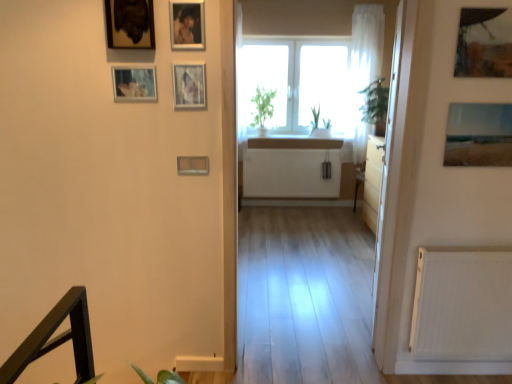
Measure the distance between point (147, 45) and camera.

Point (147, 45) and camera are 1.94 meters apart.

Identify the location of metallic silver picture frame at upper left, the seventh picture frame positioned from the right. (134, 83).

Measure the distance between point [189,31] and camera.

A distance of 1.93 meters exists between point [189,31] and camera.

This screenshot has height=384, width=512. What do you see at coordinates (187, 25) in the screenshot?
I see `metallic photo frame at upper center, arranged as the 4th picture frame when viewed from the left` at bounding box center [187, 25].

Measure the distance between matte plastic picture frame at center, which ranks as the fifth picture frame in right-to-left order, and camera.

The depth of matte plastic picture frame at center, which ranks as the fifth picture frame in right-to-left order, is 6.82 feet.

This screenshot has height=384, width=512. What do you see at coordinates (189, 85) in the screenshot?
I see `metallic silver picture frame at upper center, which ranks as the 3th picture frame in right-to-left order` at bounding box center [189, 85].

Identify the location of matte glass landscape photo at upper right, placed as the seventh picture frame when sorted from left to right. This screenshot has height=384, width=512. (479, 135).

Is transparent glass door at right located within metallic photo frame at upper center, arranged as the 4th picture frame when viewed from the left?

No.

Is point (179, 6) closer or farther from the camera than point (372, 339)?

Point (179, 6) is closer to the camera than point (372, 339).

Starting from the transparent glass door at right, which picture frame is the 5th one in front? Please provide its 2D coordinates.

[(187, 25)]

Based on the photo, is metallic photo frame at upper center, arranged as the 4th picture frame when viewed from the left, in contact with transparent glass door at right?

metallic photo frame at upper center, arranged as the 4th picture frame when viewed from the left, and transparent glass door at right are not in contact.

Considering the relative sizes of matte plastic picture frame at center, the third picture frame positioned from the left, and metallic reflective photo frame at upper right, which appears as the 6th picture frame when viewed from the left, in the image provided, is matte plastic picture frame at center, the third picture frame positioned from the left, thinner than metallic reflective photo frame at upper right, which appears as the 6th picture frame when viewed from the left,?

No, matte plastic picture frame at center, the third picture frame positioned from the left, is not thinner than metallic reflective photo frame at upper right, which appears as the 6th picture frame when viewed from the left.

Which object is further away from the camera, matte plastic picture frame at center, the third picture frame positioned from the left, or metallic reflective photo frame at upper right, which is counted as the 2th picture frame, starting from the right?

matte plastic picture frame at center, the third picture frame positioned from the left.

From the image's perspective, is matte plastic picture frame at center, the third picture frame positioned from the left, positioned above or below metallic reflective photo frame at upper right, which appears as the 6th picture frame when viewed from the left?

From the image's perspective, matte plastic picture frame at center, the third picture frame positioned from the left, appears below metallic reflective photo frame at upper right, which appears as the 6th picture frame when viewed from the left.

How different are the orientations of transparent glass door at right and matte glass landscape photo at upper right, the first picture frame viewed from the right, in degrees?

There is a 105-degree angle between the facing directions of transparent glass door at right and matte glass landscape photo at upper right, the first picture frame viewed from the right.

Is transparent glass door at right taller than matte glass landscape photo at upper right, placed as the seventh picture frame when sorted from left to right?

Yes.

Where is `glass door located behind the matte glass landscape photo at upper right, the first picture frame viewed from the right`? The image size is (512, 384). glass door located behind the matte glass landscape photo at upper right, the first picture frame viewed from the right is located at coordinates (389, 191).

From a real-world perspective, which object rests below the other?

From a 3D spatial view, transparent glass door at right is below.

Between metallic silver picture frame at upper left, the seventh picture frame positioned from the right, and matte plastic picture frame at center, which ranks as the fifth picture frame in right-to-left order, which one has less height?

With less height is matte plastic picture frame at center, which ranks as the fifth picture frame in right-to-left order.

From a real-world perspective, relative to matte plastic picture frame at center, the third picture frame positioned from the left, is metallic silver picture frame at upper left, the seventh picture frame positioned from the right, vertically above or below?

In terms of real-world spatial position, metallic silver picture frame at upper left, the seventh picture frame positioned from the right, is above matte plastic picture frame at center, the third picture frame positioned from the left.

Considering the sizes of objects metallic silver picture frame at upper left, the seventh picture frame positioned from the right, and matte plastic picture frame at center, which ranks as the fifth picture frame in right-to-left order, in the image provided, who is thinner, metallic silver picture frame at upper left, the seventh picture frame positioned from the right, or matte plastic picture frame at center, which ranks as the fifth picture frame in right-to-left order,?

Thinner between the two is metallic silver picture frame at upper left, the seventh picture frame positioned from the right.

Is matte plastic picture frame at center, which ranks as the fifth picture frame in right-to-left order, located within metallic silver picture frame at upper left, the first picture frame in the left-to-right sequence?

Actually, matte plastic picture frame at center, which ranks as the fifth picture frame in right-to-left order, is outside metallic silver picture frame at upper left, the first picture frame in the left-to-right sequence.

Based on the photo, how many degrees apart are the facing directions of metallic silver picture frame at upper left, the first picture frame in the left-to-right sequence, and metallic silver picture frame at upper center, which appears as the 5th picture frame when viewed from the left?

They differ by 0.00981 degrees in their facing directions.

Can you see metallic silver picture frame at upper left, the first picture frame in the left-to-right sequence, touching metallic silver picture frame at upper center, which appears as the 5th picture frame when viewed from the left?

metallic silver picture frame at upper left, the first picture frame in the left-to-right sequence, and metallic silver picture frame at upper center, which appears as the 5th picture frame when viewed from the left, are clearly separated.

Considering the sizes of objects metallic silver picture frame at upper left, the first picture frame in the left-to-right sequence, and metallic silver picture frame at upper center, which ranks as the 3th picture frame in right-to-left order, in the image provided, who is smaller, metallic silver picture frame at upper left, the first picture frame in the left-to-right sequence, or metallic silver picture frame at upper center, which ranks as the 3th picture frame in right-to-left order,?

With smaller size is metallic silver picture frame at upper left, the first picture frame in the left-to-right sequence.

In the scene shown: Considering the sizes of metallic silver picture frame at upper left, the seventh picture frame positioned from the right, and metallic silver picture frame at upper center, which appears as the 5th picture frame when viewed from the left, in the image, is metallic silver picture frame at upper left, the seventh picture frame positioned from the right, taller or shorter than metallic silver picture frame at upper center, which appears as the 5th picture frame when viewed from the left,?

In the image, metallic silver picture frame at upper left, the seventh picture frame positioned from the right, appears to be shorter than metallic silver picture frame at upper center, which appears as the 5th picture frame when viewed from the left.

Looking at this image, are metallic silver picture frame at upper left, the first picture frame in the left-to-right sequence, and metallic photo frame at upper center, arranged as the 4th picture frame when viewed from the left, located far from each other?

metallic silver picture frame at upper left, the first picture frame in the left-to-right sequence, is near metallic photo frame at upper center, arranged as the 4th picture frame when viewed from the left, not far away.

Based on the photo, from a real-world perspective, is metallic silver picture frame at upper left, the seventh picture frame positioned from the right, physically located above or below metallic photo frame at upper center, arranged as the 4th picture frame when viewed from the left?

Clearly, from a real-world perspective, metallic silver picture frame at upper left, the seventh picture frame positioned from the right, is below metallic photo frame at upper center, arranged as the 4th picture frame when viewed from the left.

Is the position of metallic silver picture frame at upper left, the first picture frame in the left-to-right sequence, less distant than that of metallic photo frame at upper center, arranged as the 4th picture frame when viewed from the left?

No, metallic silver picture frame at upper left, the first picture frame in the left-to-right sequence, is behind metallic photo frame at upper center, arranged as the 4th picture frame when viewed from the left.

Is metallic silver picture frame at upper left, the first picture frame in the left-to-right sequence, bigger than metallic photo frame at upper center, arranged as the 4th picture frame when viewed from the left?

No, metallic silver picture frame at upper left, the first picture frame in the left-to-right sequence, is not bigger than metallic photo frame at upper center, arranged as the 4th picture frame when viewed from the left.

Is metallic silver picture frame at upper center, which ranks as the 3th picture frame in right-to-left order, not within metallic photo frame at upper center, placed as the 4th picture frame when sorted from right to left?

Yes, metallic silver picture frame at upper center, which ranks as the 3th picture frame in right-to-left order, is located beyond the bounds of metallic photo frame at upper center, placed as the 4th picture frame when sorted from right to left.

From a real-world perspective, which picture frame is the 3rd one underneath the metallic photo frame at upper center, arranged as the 4th picture frame when viewed from the left? Please provide its 2D coordinates.

[(189, 85)]

From the image's perspective, is metallic silver picture frame at upper center, which appears as the 5th picture frame when viewed from the left, located above or below metallic photo frame at upper center, arranged as the 4th picture frame when viewed from the left?

Based on their image positions, metallic silver picture frame at upper center, which appears as the 5th picture frame when viewed from the left, is located beneath metallic photo frame at upper center, arranged as the 4th picture frame when viewed from the left.

This screenshot has height=384, width=512. I want to click on glass door behind the metallic photo frame at upper center, placed as the 4th picture frame when sorted from right to left, so click(x=389, y=191).

Identify the location of the 4th picture frame directly beneath the metallic reflective photo frame at upper right, which appears as the 6th picture frame when viewed from the left (from a real-world perspective). Image resolution: width=512 pixels, height=384 pixels. (192, 165).

When comparing their distances from metallic reflective photo frame at upper right, which is counted as the 2th picture frame, starting from the right, does matte plastic picture frame at center, the third picture frame positioned from the left, or white matte radiator at right seem further?

matte plastic picture frame at center, the third picture frame positioned from the left, is further to metallic reflective photo frame at upper right, which is counted as the 2th picture frame, starting from the right.

Looking at the image, which one is located closer to metallic reflective photo frame at upper right, which appears as the 6th picture frame when viewed from the left, transparent glass door at right or metallic silver picture frame at upper center, which appears as the 5th picture frame when viewed from the left?

Based on the image, transparent glass door at right appears to be nearer to metallic reflective photo frame at upper right, which appears as the 6th picture frame when viewed from the left.

From the image, which object appears to be farther from metallic photo frame at upper center, arranged as the 4th picture frame when viewed from the left, metallic silver picture frame at upper left, the seventh picture frame positioned from the right, or wooden framed painting at upper left, acting as the sixth picture frame starting from the right?

metallic silver picture frame at upper left, the seventh picture frame positioned from the right, is positioned further to the anchor metallic photo frame at upper center, arranged as the 4th picture frame when viewed from the left.

Looking at the image, which one is located closer to metallic reflective photo frame at upper right, which is counted as the 2th picture frame, starting from the right, metallic photo frame at upper center, placed as the 4th picture frame when sorted from right to left, or wooden framed painting at upper left, which appears as the 2th picture frame when viewed from the left?

Among the two, metallic photo frame at upper center, placed as the 4th picture frame when sorted from right to left, is located nearer to metallic reflective photo frame at upper right, which is counted as the 2th picture frame, starting from the right.

When comparing their distances from matte plastic picture frame at center, the third picture frame positioned from the left, does metallic reflective photo frame at upper right, which is counted as the 2th picture frame, starting from the right, or metallic photo frame at upper center, placed as the 4th picture frame when sorted from right to left, seem closer?

metallic photo frame at upper center, placed as the 4th picture frame when sorted from right to left, is positioned closer to the anchor matte plastic picture frame at center, the third picture frame positioned from the left.

Based on their spatial positions, is wooden framed painting at upper left, which appears as the 2th picture frame when viewed from the left, or transparent glass door at right further from white matte radiator at right?

wooden framed painting at upper left, which appears as the 2th picture frame when viewed from the left, is positioned further to the anchor white matte radiator at right.

Which object lies nearer to the anchor point matte glass landscape photo at upper right, the first picture frame viewed from the right, wooden framed painting at upper left, which appears as the 2th picture frame when viewed from the left, or matte plastic picture frame at center, which ranks as the fifth picture frame in right-to-left order?

matte plastic picture frame at center, which ranks as the fifth picture frame in right-to-left order, is closer to matte glass landscape photo at upper right, the first picture frame viewed from the right.

Which object lies nearer to the anchor point metallic photo frame at upper center, arranged as the 4th picture frame when viewed from the left, matte plastic picture frame at center, the third picture frame positioned from the left, or white matte radiator at right?

matte plastic picture frame at center, the third picture frame positioned from the left, is positioned closer to the anchor metallic photo frame at upper center, arranged as the 4th picture frame when viewed from the left.

You are a GUI agent. You are given a task and a screenshot of the screen. Output one action in this format:
    pyautogui.click(x=<x>, y=<y>)
    Task: Click on the glass door located between metallic silver picture frame at upper left, the first picture frame in the left-to-right sequence, and metallic reflective photo frame at upper right, which is counted as the 2th picture frame, starting from the right, in the left-right direction
    The height and width of the screenshot is (384, 512).
    Given the screenshot: What is the action you would take?
    pyautogui.click(x=389, y=191)

You are a GUI agent. You are given a task and a screenshot of the screen. Output one action in this format:
    pyautogui.click(x=<x>, y=<y>)
    Task: Click on the glass door situated between metallic silver picture frame at upper left, the first picture frame in the left-to-right sequence, and white matte radiator at right from left to right
    
    Given the screenshot: What is the action you would take?
    pyautogui.click(x=389, y=191)

Where is `radiator between wooden framed painting at upper left, acting as the sixth picture frame starting from the right, and matte glass landscape photo at upper right, the first picture frame viewed from the right, from left to right`? radiator between wooden framed painting at upper left, acting as the sixth picture frame starting from the right, and matte glass landscape photo at upper right, the first picture frame viewed from the right, from left to right is located at coordinates (462, 304).

This screenshot has width=512, height=384. In order to click on glass door located between matte plastic picture frame at center, the third picture frame positioned from the left, and metallic reflective photo frame at upper right, which is counted as the 2th picture frame, starting from the right, in the left-right direction in this screenshot , I will do [x=389, y=191].